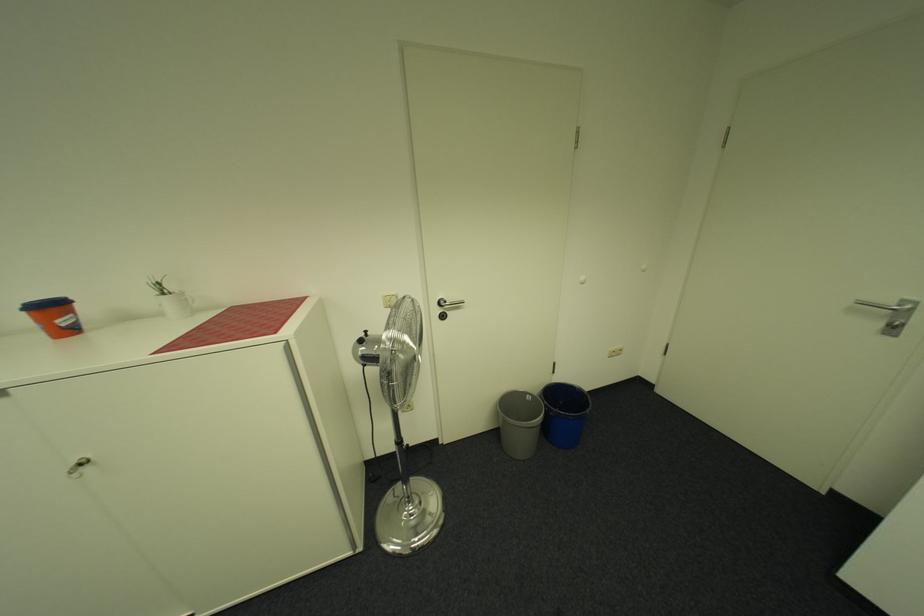
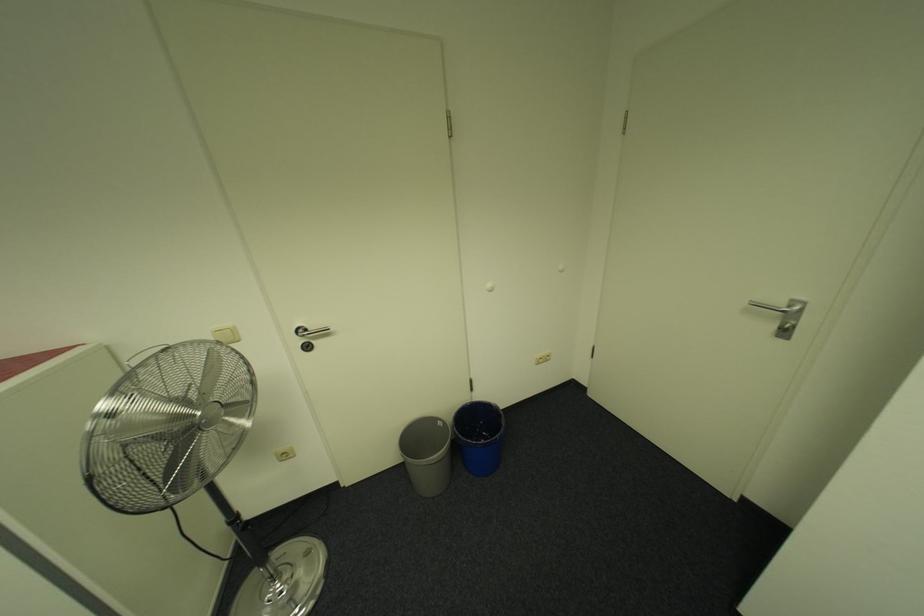
What movement of the cameraman would produce the second image?

The cameraman moved toward right, forward.